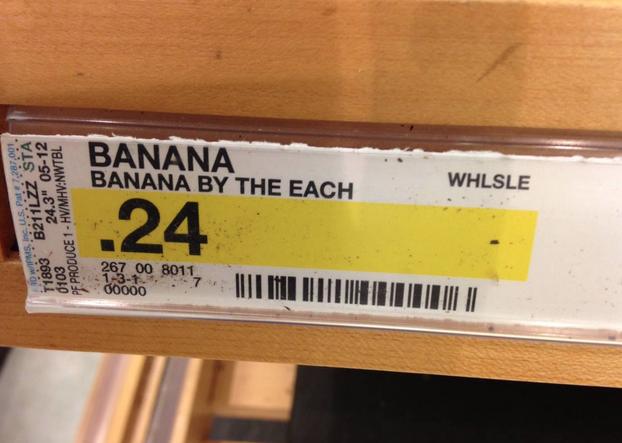
I want to click on floor, so click(x=29, y=388).